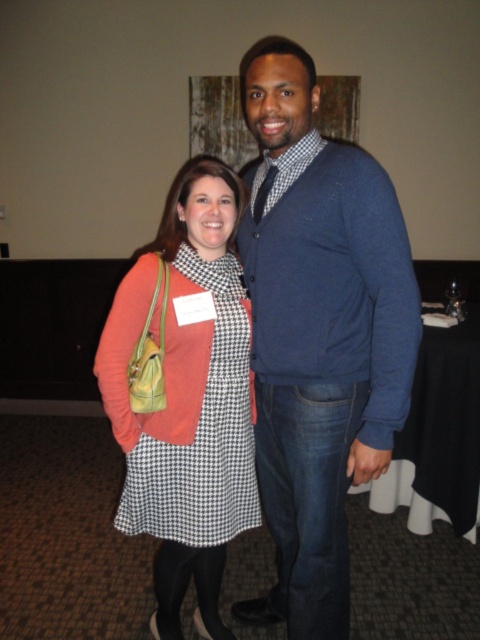
Question: Is blue sweater at center thinner than matte orange sweater at left?

Choices:
 (A) no
 (B) yes

Answer: (A)

Question: Which point is closer to the camera taking this photo?

Choices:
 (A) (309, 436)
 (B) (206, 499)

Answer: (A)

Question: Is the position of blue sweater at center less distant than that of matte orange sweater at left?

Choices:
 (A) no
 (B) yes

Answer: (B)

Question: Does blue sweater at center have a lesser width compared to matte orange sweater at left?

Choices:
 (A) no
 (B) yes

Answer: (A)

Question: Which of the following is the closest to the observer?

Choices:
 (A) matte orange sweater at left
 (B) blue sweater at center

Answer: (B)